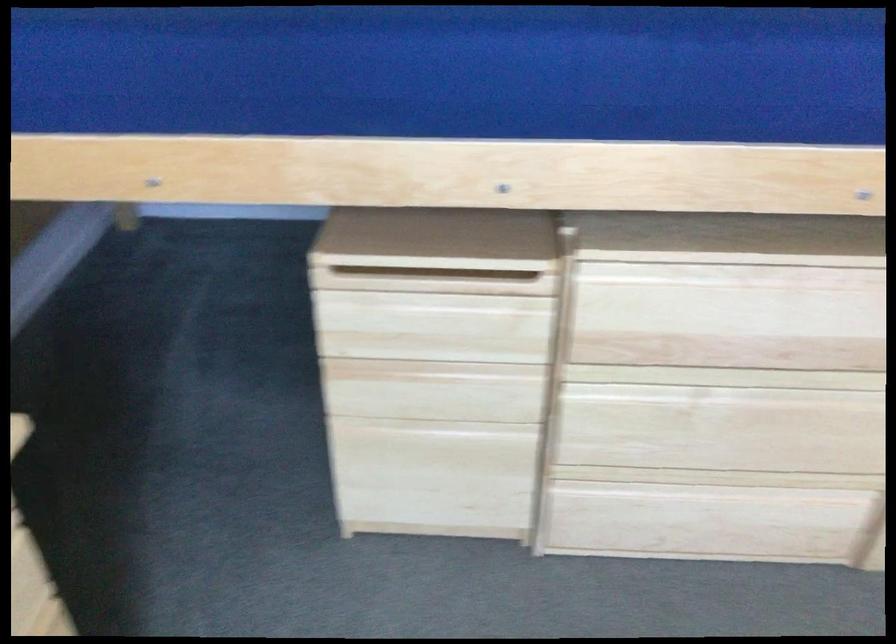
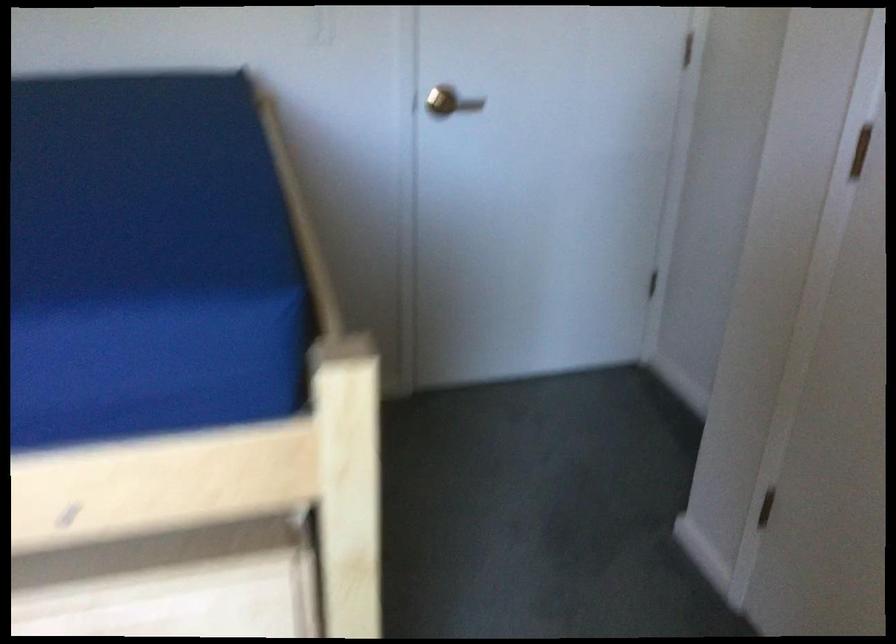
Question: The camera is either moving clockwise (left) or counter-clockwise (right) around the object. The first image is from the beginning of the video and the second image is from the end. Is the camera moving left or right when shooting the video?

Choices:
 (A) Left
 (B) Right

Answer: (A)